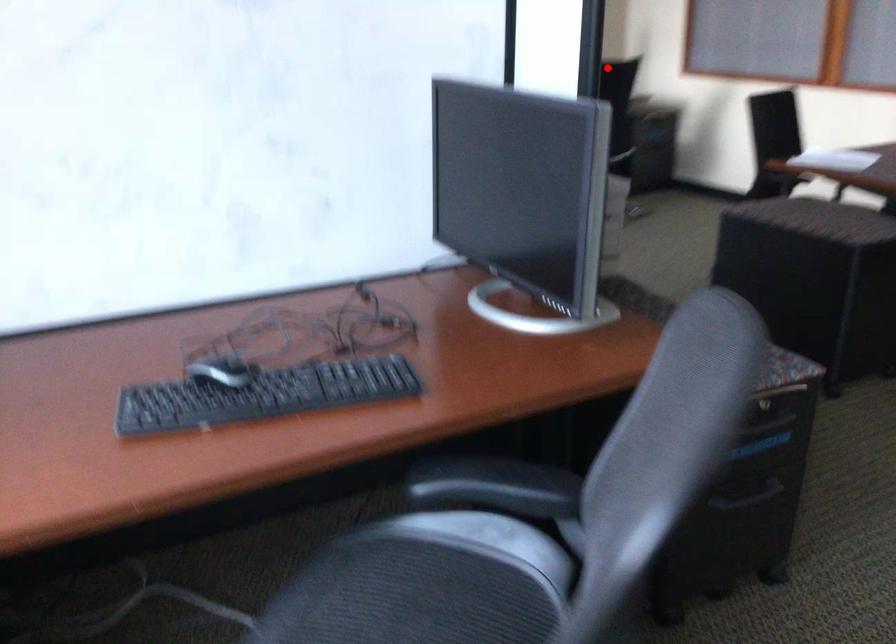
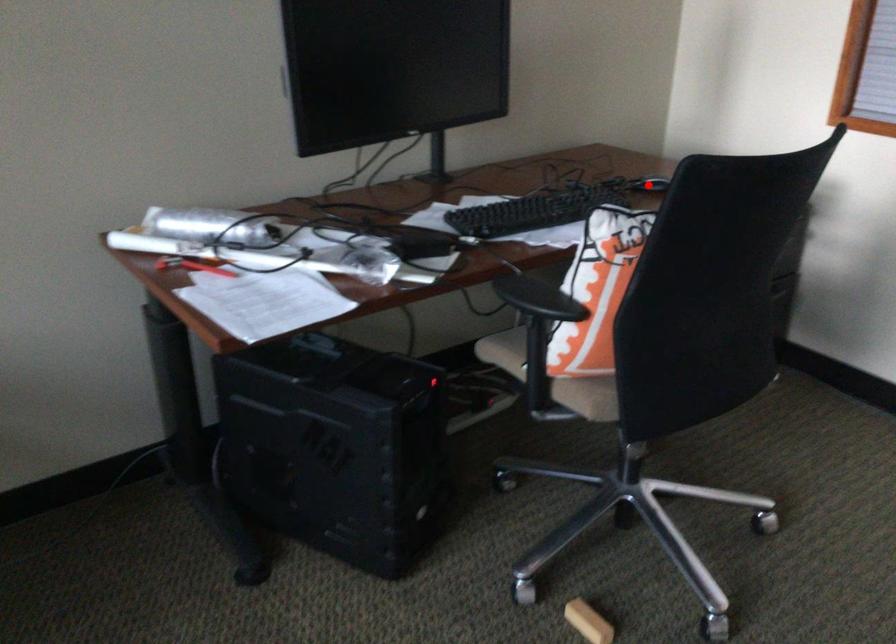
I am providing you with two images of the same scene from different viewpoints. A red point is marked on the first image and another point is marked on the second image. Does the point marked in image1 correspond to the same location as the one in image2?

No